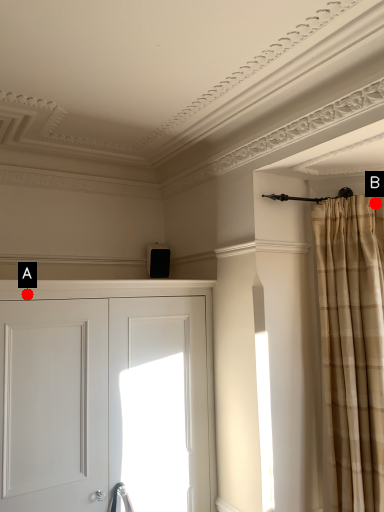
Question: Two points are circled on the image, labeled by A and B beside each circle. Which of the following is the closest to the observer?

Choices:
 (A) A is closer
 (B) B is closer

Answer: (A)